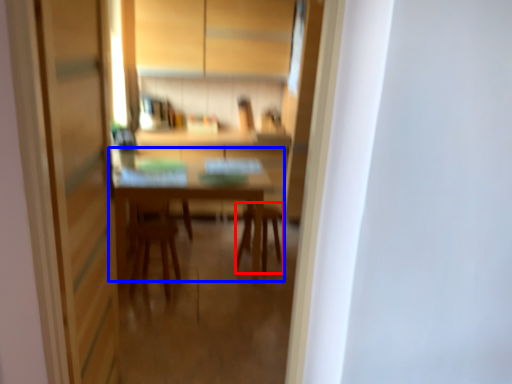
Question: Which object appears closest to the camera in this image, chair (highlighted by a red box) or table (highlighted by a blue box)?

Choices:
 (A) chair
 (B) table

Answer: (B)